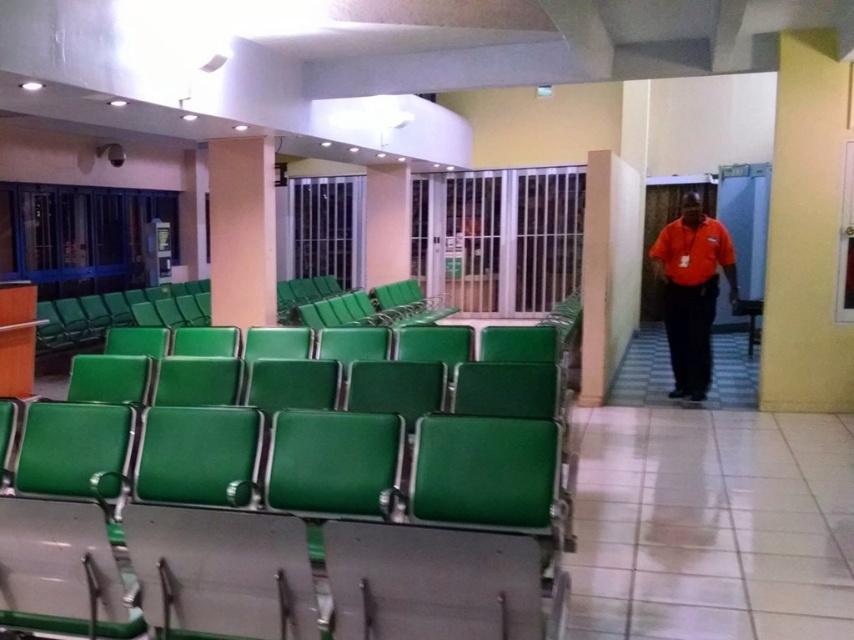
Question: Is green plastic chairs at left positioned in front of orange shirt at center?

Choices:
 (A) no
 (B) yes

Answer: (B)

Question: Which object is positioned closest to the white glossy pillar at center?

Choices:
 (A) matte green pillar at upper center
 (B) orange shirt at center
 (C) green painted concrete pillar at right

Answer: (A)

Question: Which object appears closest to the camera in this image?

Choices:
 (A) green plastic chairs at left
 (B) white glossy pillar at center

Answer: (A)

Question: Which object is farther from the camera taking this photo?

Choices:
 (A) orange shirt at center
 (B) green painted concrete pillar at right

Answer: (B)

Question: Is matte green pillar at upper center positioned in front of white glossy pillar at center?

Choices:
 (A) yes
 (B) no

Answer: (A)

Question: Is matte green pillar at upper center positioned in front of orange shirt at center?

Choices:
 (A) yes
 (B) no

Answer: (B)